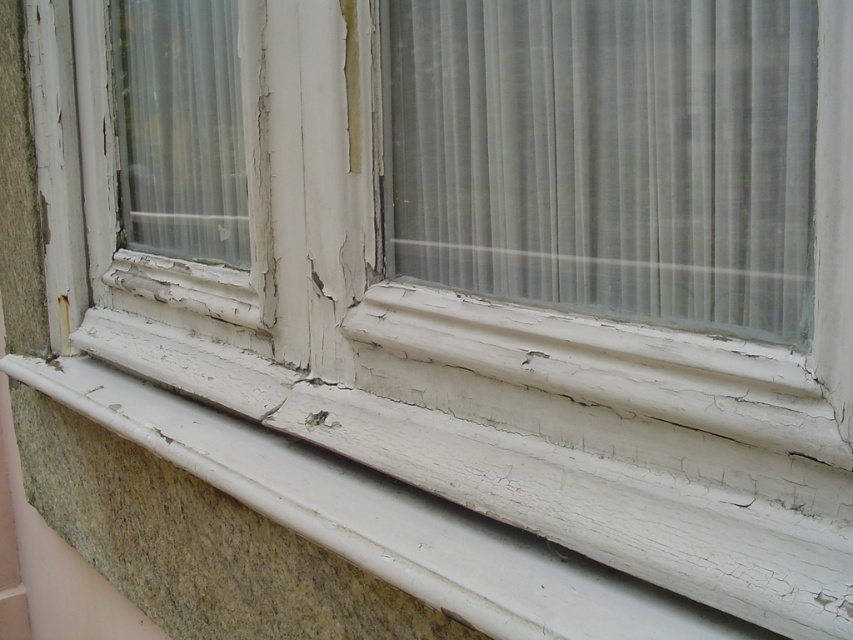
Question: Observing the image, what is the correct spatial positioning of translucent fabric curtain at center in reference to white cracked wood at lower center?

Choices:
 (A) above
 (B) below

Answer: (A)

Question: Which of the following is the closest to the observer?

Choices:
 (A) (161, 410)
 (B) (521, 51)

Answer: (B)

Question: Where is translucent fabric curtain at center located in relation to white cracked wood at lower center in the image?

Choices:
 (A) right
 (B) left

Answer: (A)

Question: In this image, where is translucent fabric curtain at center located relative to white cracked wood at lower center?

Choices:
 (A) above
 (B) below

Answer: (A)